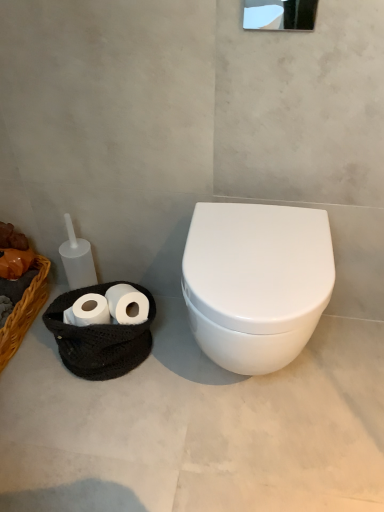
The width and height of the screenshot is (384, 512). What are the coordinates of `vacant location below white glossy toilet at center (from a real-world perspective)` in the screenshot? It's located at (256, 391).